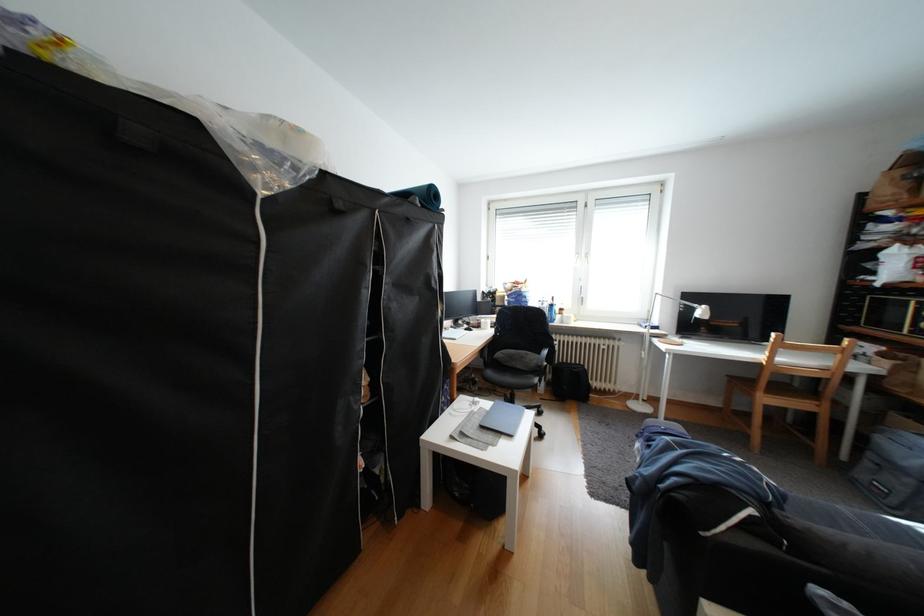
The image size is (924, 616). What do you see at coordinates (657, 351) in the screenshot?
I see `the white lamp head` at bounding box center [657, 351].